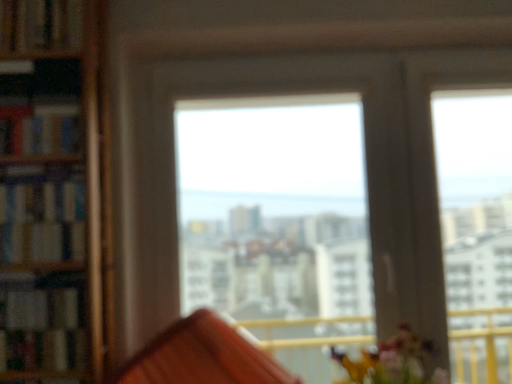
In order to face hardcover book at left, positioned as the 2th book in bottom-to-top order, should I rotate leftwards or rightwards?

To face it directly, rotate left by 25.902 degrees.

In order to click on hardcover book at left, positioned as the 2th book in bottom-to-top order in this screenshot , I will do click(x=41, y=216).

What is the approximate width of hardcover book at left, which is the second book from top to bottom?

hardcover book at left, which is the second book from top to bottom, is 12.99 centimeters wide.

What is the approximate width of hardcover book at upper left, the 1th book viewed from the top?

hardcover book at upper left, the 1th book viewed from the top, is 3.64 inches wide.

Find the location of a particular element. transparent glass window at center is located at coordinates (366, 166).

Considering the positions of points (35, 173) and (25, 13), is point (35, 173) closer to camera compared to point (25, 13)?

Yes, point (35, 173) is in front of point (25, 13).

Between hardcover book at left, positioned as the 3th book in top-to-bottom order, and hardcover book at upper left, marked as the fourth book in a bottom-to-top arrangement, which one appears on the left side from the viewer's perspective?

hardcover book at upper left, marked as the fourth book in a bottom-to-top arrangement.

From the image's perspective, who appears lower, hardcover book at left, positioned as the 2th book in bottom-to-top order, or hardcover book at upper left, marked as the fourth book in a bottom-to-top arrangement?

hardcover book at left, positioned as the 2th book in bottom-to-top order.

Is hardcover book at left, positioned as the 2th book in bottom-to-top order, positioned far away from hardcover book at upper left, marked as the fourth book in a bottom-to-top arrangement?

No, there isn't a large distance between hardcover book at left, positioned as the 2th book in bottom-to-top order, and hardcover book at upper left, marked as the fourth book in a bottom-to-top arrangement.

Could transparent glass window at center be considered to be inside hardcover book at upper left, the 1th book viewed from the top?

No, hardcover book at upper left, the 1th book viewed from the top, does not contain transparent glass window at center.

Based on the photo, in terms of size, does hardcover book at upper left, the 1th book viewed from the top, appear bigger or smaller than transparent glass window at center?

hardcover book at upper left, the 1th book viewed from the top, is smaller than transparent glass window at center.

From a real-world perspective, is hardcover book at upper left, the 1th book viewed from the top, physically above transparent glass window at center?

Yes.

Can you tell me how much hardcover book at upper left, the 1th book viewed from the top, and transparent glass window at center differ in facing direction?

They differ by 0.319 degrees in their facing directions.

From the image's perspective, who appears lower, hardcover book at left, positioned as the 2th book in bottom-to-top order, or transparent glass window at center?

transparent glass window at center appears lower in the image.

Is hardcover book at left, positioned as the 2th book in bottom-to-top order, outside of transparent glass window at center?

Yes, hardcover book at left, positioned as the 2th book in bottom-to-top order, is located beyond the bounds of transparent glass window at center.

Does hardcover book at left, positioned as the 2th book in bottom-to-top order, have a smaller size compared to transparent glass window at center?

Yes, hardcover book at left, positioned as the 2th book in bottom-to-top order, is smaller than transparent glass window at center.

Does wooden bookshelf at left, the first book in the bottom-to-top sequence, have a greater width compared to transparent glass window at center?

Yes.

Is there a large distance between wooden bookshelf at left, which is the 4th book in top-to-bottom order, and transparent glass window at center?

No, wooden bookshelf at left, which is the 4th book in top-to-bottom order, is not far from transparent glass window at center.

Is wooden bookshelf at left, the first book in the bottom-to-top sequence, to the right of transparent glass window at center from the viewer's perspective?

Incorrect, wooden bookshelf at left, the first book in the bottom-to-top sequence, is not on the right side of transparent glass window at center.

Considering the points (12, 281) and (424, 194), which point is in front, point (12, 281) or point (424, 194)?

The point (12, 281) is more forward.

From a real-world perspective, is hardcover book at left, which is the 3th book from bottom to top, on hardcover book at left, positioned as the 3th book in top-to-bottom order?

Indeed, from a real-world perspective, hardcover book at left, which is the 3th book from bottom to top, stands above hardcover book at left, positioned as the 3th book in top-to-bottom order.

Which book is the 1st one when counting from the left side of the hardcover book at left, positioned as the 2th book in bottom-to-top order? Please provide its 2D coordinates.

[(39, 125)]

Is hardcover book at left, which is the 3th book from bottom to top, bigger than hardcover book at left, positioned as the 3th book in top-to-bottom order?

Yes.

From their relative heights in the image, would you say hardcover book at left, which is the 3th book from bottom to top, is taller or shorter than hardcover book at left, positioned as the 2th book in bottom-to-top order?

Clearly, hardcover book at left, which is the 3th book from bottom to top, is shorter compared to hardcover book at left, positioned as the 2th book in bottom-to-top order.

Who is bigger, hardcover book at left, positioned as the 2th book in bottom-to-top order, or hardcover book at left, which is the 3th book from bottom to top?

Answer: Bigger between the two is hardcover book at left, which is the 3th book from bottom to top.

From the image's perspective, is hardcover book at left, positioned as the 2th book in bottom-to-top order, beneath hardcover book at left, which is the 3th book from bottom to top?

Indeed, from the image's perspective, hardcover book at left, positioned as the 2th book in bottom-to-top order, is shown beneath hardcover book at left, which is the 3th book from bottom to top.

Would you say hardcover book at left, positioned as the 3th book in top-to-bottom order, is inside or outside hardcover book at left, which is the second book from top to bottom?

hardcover book at left, positioned as the 3th book in top-to-bottom order, is not inside hardcover book at left, which is the second book from top to bottom, it's outside.

Find the location of a particular element. book that is the 1st object located in front of the hardcover book at left, which is the second book from top to bottom is located at coordinates (41, 216).

Can you confirm if hardcover book at left, which is the 3th book from bottom to top, is bigger than hardcover book at upper left, marked as the fourth book in a bottom-to-top arrangement?

Yes.

From a real-world perspective, is hardcover book at left, which is the 3th book from bottom to top, located beneath hardcover book at upper left, marked as the fourth book in a bottom-to-top arrangement?

Correct, in the physical world, hardcover book at left, which is the 3th book from bottom to top, is lower than hardcover book at upper left, marked as the fourth book in a bottom-to-top arrangement.

Which object is closer to the camera taking this photo, hardcover book at left, which is the 3th book from bottom to top, or hardcover book at upper left, marked as the fourth book in a bottom-to-top arrangement?

hardcover book at left, which is the 3th book from bottom to top.

What's the angular difference between hardcover book at left, which is the 3th book from bottom to top, and hardcover book at upper left, marked as the fourth book in a bottom-to-top arrangement,'s facing directions?

0.000601 degrees.

There is a hardcover book at upper left, the 1th book viewed from the top. At what (x,y) coordinates should I click in order to perform the action: click on the 2nd book below it (from a real-world perspective). Please return your answer as a coordinate pair (x, y). This screenshot has width=512, height=384. Looking at the image, I should click on (41, 216).

Locate an element on the screen. The height and width of the screenshot is (384, 512). window below the hardcover book at upper left, the 1th book viewed from the top (from the image's perspective) is located at coordinates (366, 166).

Looking at the image, which one is located further to hardcover book at upper left, marked as the fourth book in a bottom-to-top arrangement, hardcover book at left, positioned as the 2th book in bottom-to-top order, or transparent glass window at center?

transparent glass window at center is positioned further to the anchor hardcover book at upper left, marked as the fourth book in a bottom-to-top arrangement.

Based on their spatial positions, is transparent glass window at center or hardcover book at upper left, the 1th book viewed from the top, further from wooden bookshelf at left, the first book in the bottom-to-top sequence?

hardcover book at upper left, the 1th book viewed from the top, is positioned further to the anchor wooden bookshelf at left, the first book in the bottom-to-top sequence.

Based on their spatial positions, is wooden bookshelf at left, the first book in the bottom-to-top sequence, or hardcover book at left, positioned as the 3th book in top-to-bottom order, closer to hardcover book at left, which is the 3th book from bottom to top?

hardcover book at left, positioned as the 3th book in top-to-bottom order, is positioned closer to the anchor hardcover book at left, which is the 3th book from bottom to top.

Estimate the real-world distances between objects in this image. Which object is further from wooden bookshelf at left, the first book in the bottom-to-top sequence, hardcover book at upper left, marked as the fourth book in a bottom-to-top arrangement, or transparent glass window at center?

The object further to wooden bookshelf at left, the first book in the bottom-to-top sequence, is hardcover book at upper left, marked as the fourth book in a bottom-to-top arrangement.

Based on their spatial positions, is wooden bookshelf at left, which is the 4th book in top-to-bottom order, or hardcover book at left, positioned as the 3th book in top-to-bottom order, closer to transparent glass window at center?

Based on the image, hardcover book at left, positioned as the 3th book in top-to-bottom order, appears to be nearer to transparent glass window at center.

Based on their spatial positions, is hardcover book at left, positioned as the 2th book in bottom-to-top order, or hardcover book at left, which is the second book from top to bottom, closer to transparent glass window at center?

hardcover book at left, positioned as the 2th book in bottom-to-top order, lies closer to transparent glass window at center than the other object.

Based on their spatial positions, is wooden bookshelf at left, the first book in the bottom-to-top sequence, or hardcover book at upper left, marked as the fourth book in a bottom-to-top arrangement, closer to hardcover book at left, positioned as the 2th book in bottom-to-top order?

wooden bookshelf at left, the first book in the bottom-to-top sequence, is positioned closer to the anchor hardcover book at left, positioned as the 2th book in bottom-to-top order.

Considering their positions, is hardcover book at upper left, the 1th book viewed from the top, positioned further to transparent glass window at center than hardcover book at left, which is the second book from top to bottom?

hardcover book at upper left, the 1th book viewed from the top, is further to transparent glass window at center.

Locate an element on the screen. This screenshot has height=384, width=512. book between hardcover book at upper left, marked as the fourth book in a bottom-to-top arrangement, and hardcover book at left, positioned as the 3th book in top-to-bottom order, in the up-down direction is located at coordinates (39, 125).

You are a GUI agent. You are given a task and a screenshot of the screen. Output one action in this format:
    pyautogui.click(x=<x>, y=<y>)
    Task: Click on the book situated between hardcover book at left, positioned as the 2th book in bottom-to-top order, and transparent glass window at center from left to right
    The image size is (512, 384).
    Given the screenshot: What is the action you would take?
    pyautogui.click(x=41, y=328)

At what (x,y) coordinates should I click in order to perform the action: click on book between hardcover book at left, which is the 3th book from bottom to top, and wooden bookshelf at left, which is the 4th book in top-to-bottom order, in the up-down direction. Please return your answer as a coordinate pair (x, y). Image resolution: width=512 pixels, height=384 pixels. Looking at the image, I should click on (41, 216).

Where is `window between hardcover book at upper left, the 1th book viewed from the top, and wooden bookshelf at left, which is the 4th book in top-to-bottom order, in the up-down direction`? The image size is (512, 384). window between hardcover book at upper left, the 1th book viewed from the top, and wooden bookshelf at left, which is the 4th book in top-to-bottom order, in the up-down direction is located at coordinates (366, 166).